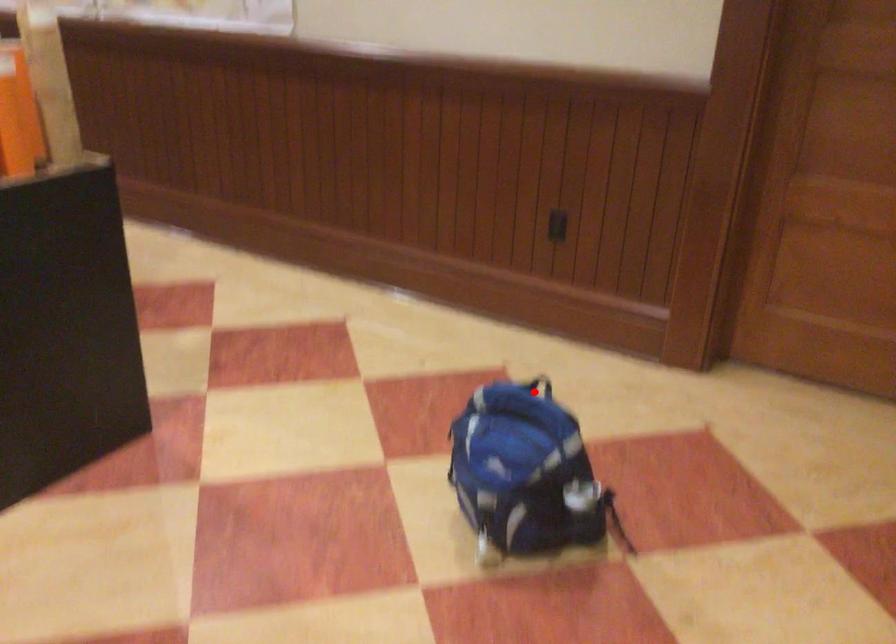
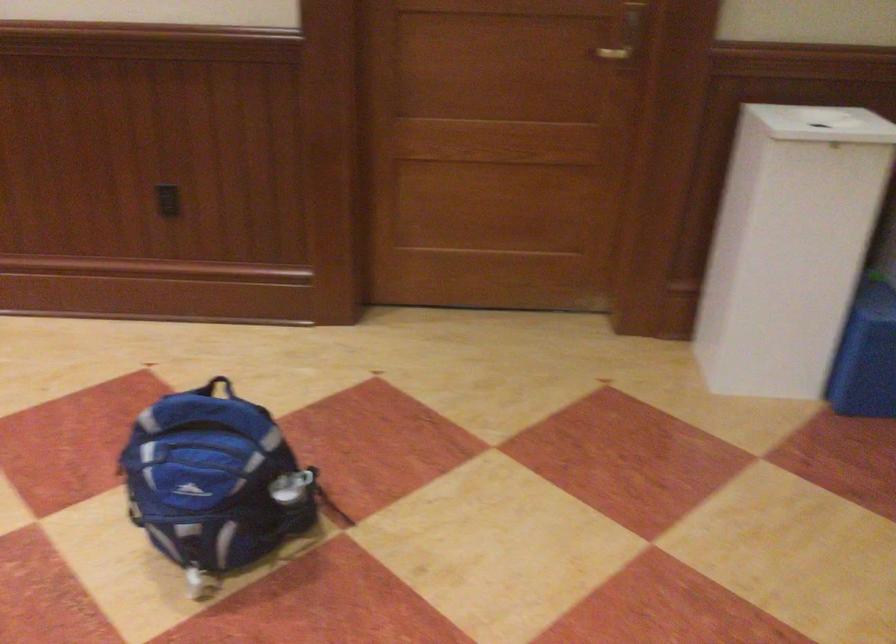
Locate, in the second image, the point that corresponds to the highlighted location in the first image.

(217, 386)